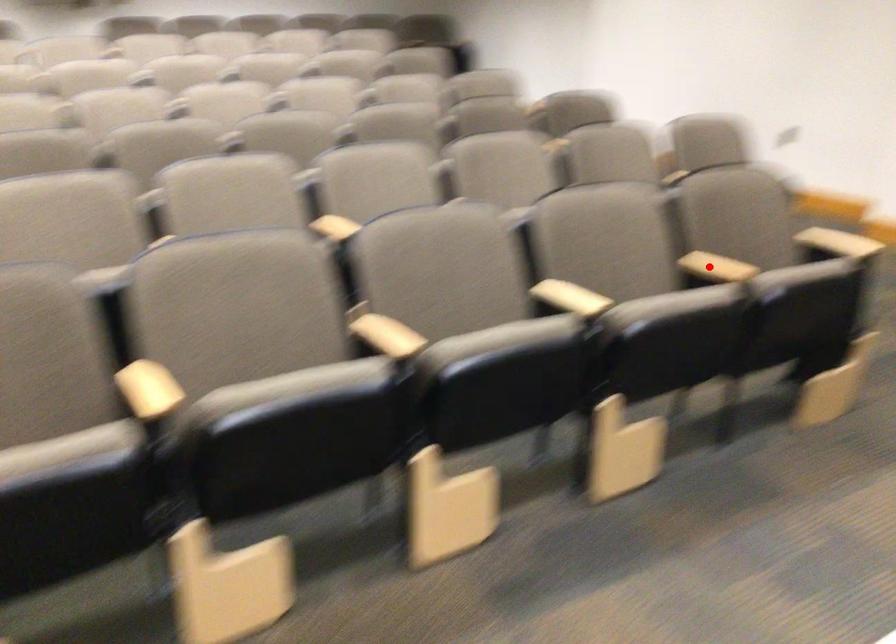
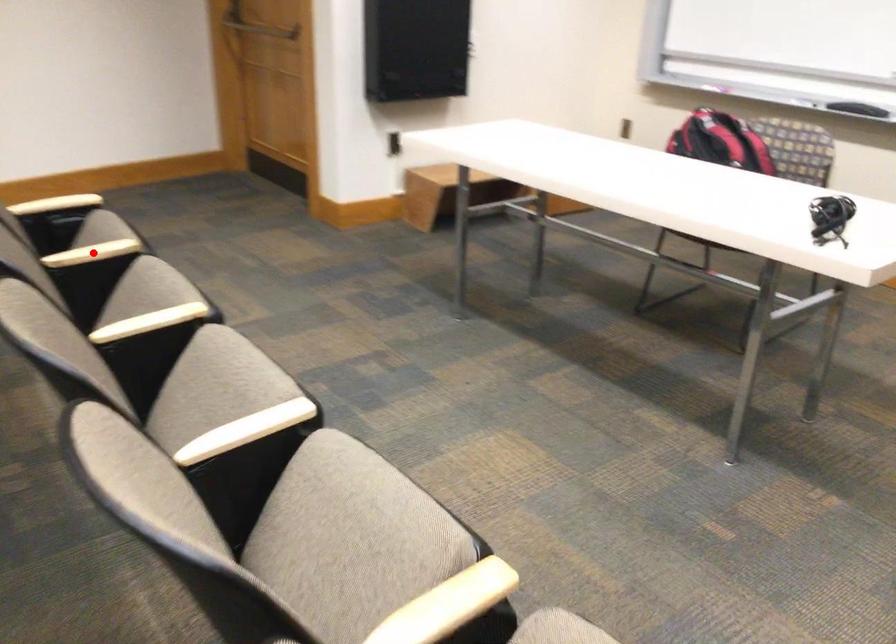
I am providing you with two images of the same scene from different viewpoints. A red point is marked on the first image and another point is marked on the second image. Does the point marked in image1 correspond to the same location as the one in image2?

Yes